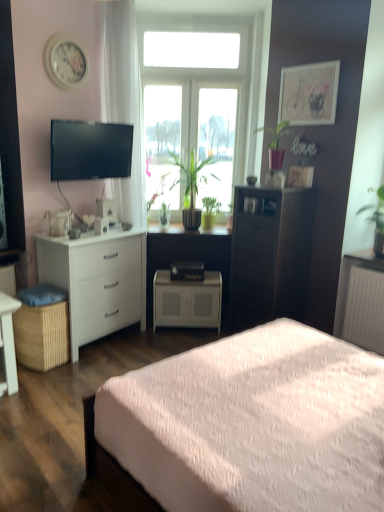
Where is `vacant space in front of brown woven picnic basket at lower left`? vacant space in front of brown woven picnic basket at lower left is located at coordinates (40, 376).